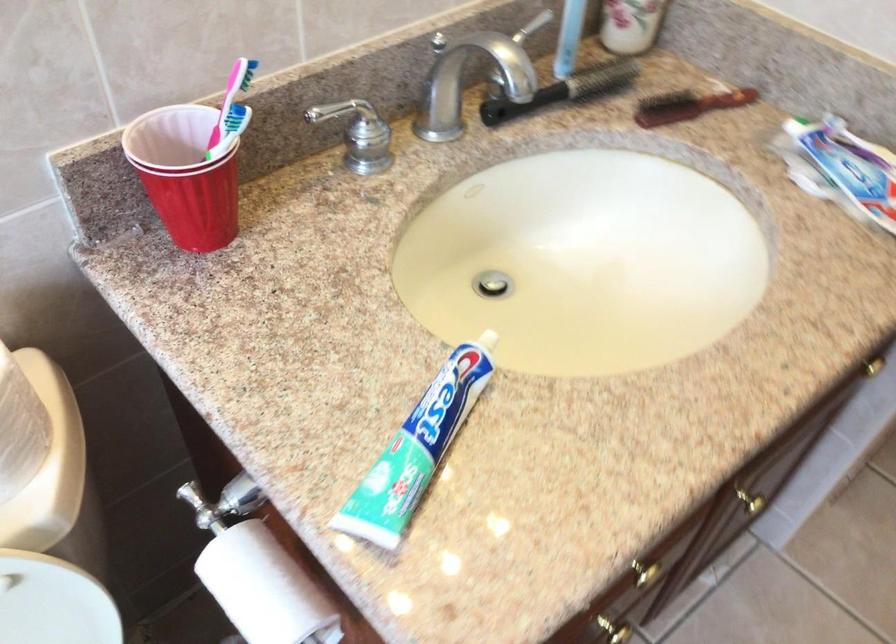
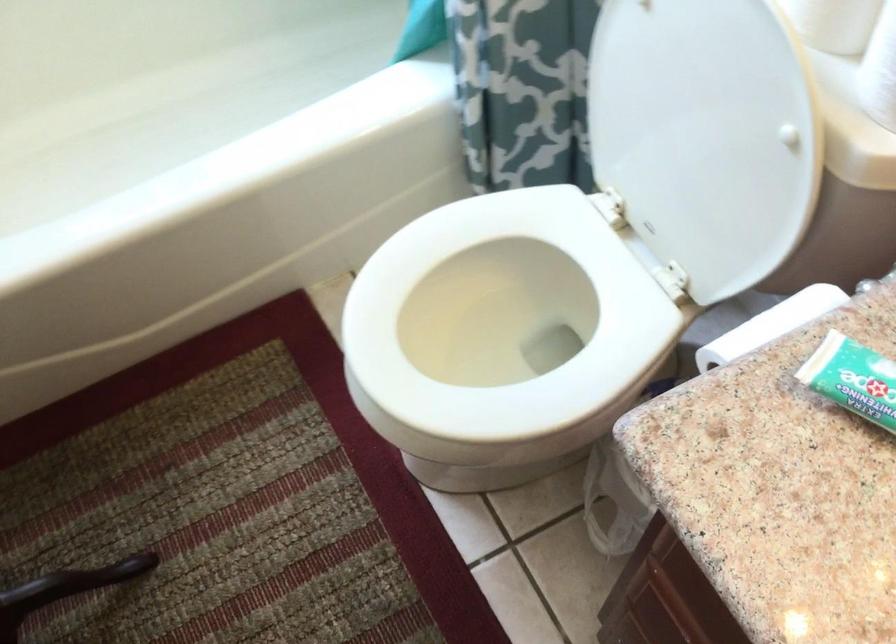
Locate, in the second image, the point that corresponds to point 380,516 in the first image.

(853, 379)